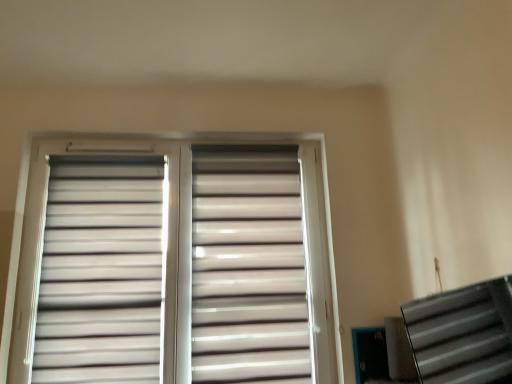
This screenshot has height=384, width=512. Describe the element at coordinates (101, 273) in the screenshot. I see `white matte shutter at upper left, acting as the 2th shutter starting from the right` at that location.

This screenshot has width=512, height=384. What are the coordinates of `matte white blinds at center` in the screenshot? It's located at (173, 265).

Based on their positions, is matte white blinds at center located to the left or right of white matte shutter at upper left, the first shutter viewed from the left?

Based on their positions, matte white blinds at center is located to the right of white matte shutter at upper left, the first shutter viewed from the left.

Is matte white blinds at center further to the viewer compared to white matte shutter at upper left, acting as the 2th shutter starting from the right?

Yes, the depth of matte white blinds at center is greater than that of white matte shutter at upper left, acting as the 2th shutter starting from the right.

The image size is (512, 384). In order to click on window that is behind the white matte shutter at upper left, the first shutter viewed from the left in this screenshot , I will do (173, 265).

Does point (170, 287) lie in front of point (108, 175)?

That is True.

From a real-world perspective, relative to matte white blinds at center, is metallic silver stairwell at lower right vertically above or below?

metallic silver stairwell at lower right is situated lower than matte white blinds at center in the real world.

From the image's perspective, between metallic silver stairwell at lower right and matte white blinds at center, which one is located above?

matte white blinds at center is shown above in the image.

Is metallic silver stairwell at lower right not close to matte white blinds at center?

Absolutely, metallic silver stairwell at lower right is distant from matte white blinds at center.

Is metallic silver stairwell at lower right smaller than matte white blinds at center?

Correct, metallic silver stairwell at lower right occupies less space than matte white blinds at center.

From the picture: Can you confirm if metallic silver stairwell at lower right is wider than white matte shutter at upper left, acting as the 2th shutter starting from the right?

Yes.

Who is bigger, metallic silver stairwell at lower right or white matte shutter at upper left, acting as the 2th shutter starting from the right?

With larger size is white matte shutter at upper left, acting as the 2th shutter starting from the right.

Between metallic silver stairwell at lower right and white matte shutter at upper left, the first shutter viewed from the left, which one is positioned behind?

white matte shutter at upper left, the first shutter viewed from the left.

Is metallic silver stairwell at lower right oriented towards white matte shutter at upper left, the first shutter viewed from the left?

No, metallic silver stairwell at lower right is not aimed at white matte shutter at upper left, the first shutter viewed from the left.

From the picture: From the image's perspective, is matte white shutter at center, which is counted as the 2th shutter, starting from the left, below white matte shutter at upper left, acting as the 2th shutter starting from the right?

Indeed, from the image's perspective, matte white shutter at center, which is counted as the 2th shutter, starting from the left, is shown beneath white matte shutter at upper left, acting as the 2th shutter starting from the right.

This screenshot has width=512, height=384. What are the coordinates of `shutter lying behind the white matte shutter at upper left, the first shutter viewed from the left` in the screenshot? It's located at 248,267.

Considering the relative sizes of matte white shutter at center, which is counted as the 2th shutter, starting from the left, and white matte shutter at upper left, the first shutter viewed from the left, in the image provided, is matte white shutter at center, which is counted as the 2th shutter, starting from the left, thinner than white matte shutter at upper left, the first shutter viewed from the left,?

No.

Is point (282, 263) positioned behind point (42, 274)?

That is True.

Considering the sizes of matte white blinds at center and matte white shutter at center, which appears as the first shutter when viewed from the right, in the image, is matte white blinds at center bigger or smaller than matte white shutter at center, which appears as the first shutter when viewed from the right,?

Clearly, matte white blinds at center is larger in size than matte white shutter at center, which appears as the first shutter when viewed from the right.

Is matte white blinds at center far away from matte white shutter at center, which appears as the first shutter when viewed from the right?

No, matte white blinds at center is not far from matte white shutter at center, which appears as the first shutter when viewed from the right.

From a real-world perspective, does matte white blinds at center stand above matte white shutter at center, which appears as the first shutter when viewed from the right?

Yes, from a real-world perspective, matte white blinds at center is on top of matte white shutter at center, which appears as the first shutter when viewed from the right.

Considering the sizes of matte white blinds at center and matte white shutter at center, which appears as the first shutter when viewed from the right, in the image, is matte white blinds at center wider or thinner than matte white shutter at center, which appears as the first shutter when viewed from the right,?

Considering their sizes, matte white blinds at center looks slimmer than matte white shutter at center, which appears as the first shutter when viewed from the right.

Is matte white shutter at center, which is counted as the 2th shutter, starting from the left, facing towards metallic silver stairwell at lower right?

Yes, matte white shutter at center, which is counted as the 2th shutter, starting from the left, is aimed at metallic silver stairwell at lower right.

From the image's perspective, is matte white shutter at center, which appears as the first shutter when viewed from the right, beneath metallic silver stairwell at lower right?

No, from the image's perspective, matte white shutter at center, which appears as the first shutter when viewed from the right, is not beneath metallic silver stairwell at lower right.

Is matte white shutter at center, which appears as the first shutter when viewed from the right, closer to camera compared to metallic silver stairwell at lower right?

No, the depth of matte white shutter at center, which appears as the first shutter when viewed from the right, is greater than that of metallic silver stairwell at lower right.

From the image's perspective, is white matte shutter at upper left, the first shutter viewed from the left, above matte white shutter at center, which is counted as the 2th shutter, starting from the left?

Yes, from the image's perspective, white matte shutter at upper left, the first shutter viewed from the left, is over matte white shutter at center, which is counted as the 2th shutter, starting from the left.

Is white matte shutter at upper left, the first shutter viewed from the left, looking in the opposite direction of matte white shutter at center, which appears as the first shutter when viewed from the right?

No, white matte shutter at upper left, the first shutter viewed from the left, is not facing the opposite direction of matte white shutter at center, which appears as the first shutter when viewed from the right.

Considering the positions of objects white matte shutter at upper left, the first shutter viewed from the left, and matte white shutter at center, which appears as the first shutter when viewed from the right, in the image provided, who is more to the left, white matte shutter at upper left, the first shutter viewed from the left, or matte white shutter at center, which appears as the first shutter when viewed from the right,?

white matte shutter at upper left, the first shutter viewed from the left.

You are a GUI agent. You are given a task and a screenshot of the screen. Output one action in this format:
    pyautogui.click(x=<x>, y=<y>)
    Task: Click on the shutter in front of the matte white blinds at center
    This screenshot has width=512, height=384.
    Given the screenshot: What is the action you would take?
    pyautogui.click(x=101, y=273)

The image size is (512, 384). Identify the location of window behind the metallic silver stairwell at lower right. (173, 265).

Looking at the image, which one is located further to white matte shutter at upper left, the first shutter viewed from the left, matte white blinds at center or metallic silver stairwell at lower right?

metallic silver stairwell at lower right is further to white matte shutter at upper left, the first shutter viewed from the left.

Which object lies nearer to the anchor point matte white shutter at center, which appears as the first shutter when viewed from the right, white matte shutter at upper left, acting as the 2th shutter starting from the right, or metallic silver stairwell at lower right?

Among the two, white matte shutter at upper left, acting as the 2th shutter starting from the right, is located nearer to matte white shutter at center, which appears as the first shutter when viewed from the right.

Which object lies nearer to the anchor point matte white blinds at center, metallic silver stairwell at lower right or matte white shutter at center, which is counted as the 2th shutter, starting from the left?

matte white shutter at center, which is counted as the 2th shutter, starting from the left, is closer to matte white blinds at center.

From the image, which object appears to be nearer to matte white blinds at center, matte white shutter at center, which is counted as the 2th shutter, starting from the left, or metallic silver stairwell at lower right?

Based on the image, matte white shutter at center, which is counted as the 2th shutter, starting from the left, appears to be nearer to matte white blinds at center.

Based on their spatial positions, is white matte shutter at upper left, acting as the 2th shutter starting from the right, or matte white blinds at center closer to metallic silver stairwell at lower right?

Among the two, matte white blinds at center is located nearer to metallic silver stairwell at lower right.

Estimate the real-world distances between objects in this image. Which object is closer to white matte shutter at upper left, the first shutter viewed from the left, matte white shutter at center, which is counted as the 2th shutter, starting from the left, or metallic silver stairwell at lower right?

matte white shutter at center, which is counted as the 2th shutter, starting from the left, lies closer to white matte shutter at upper left, the first shutter viewed from the left, than the other object.

When comparing their distances from matte white blinds at center, does metallic silver stairwell at lower right or white matte shutter at upper left, the first shutter viewed from the left, seem further?

metallic silver stairwell at lower right is positioned further to the anchor matte white blinds at center.

Looking at the image, which one is located further to metallic silver stairwell at lower right, matte white blinds at center or matte white shutter at center, which is counted as the 2th shutter, starting from the left?

matte white blinds at center is positioned further to the anchor metallic silver stairwell at lower right.

The height and width of the screenshot is (384, 512). I want to click on window between white matte shutter at upper left, acting as the 2th shutter starting from the right, and metallic silver stairwell at lower right from left to right, so click(173, 265).

The width and height of the screenshot is (512, 384). Find the location of `window positioned between metallic silver stairwell at lower right and matte white shutter at center, which appears as the first shutter when viewed from the right, from near to far`. window positioned between metallic silver stairwell at lower right and matte white shutter at center, which appears as the first shutter when viewed from the right, from near to far is located at coordinates (173, 265).

This screenshot has width=512, height=384. I want to click on shutter between white matte shutter at upper left, acting as the 2th shutter starting from the right, and metallic silver stairwell at lower right from left to right, so click(248, 267).

Locate an element on the screen. This screenshot has height=384, width=512. window situated between white matte shutter at upper left, the first shutter viewed from the left, and matte white shutter at center, which is counted as the 2th shutter, starting from the left, from left to right is located at coordinates (173, 265).